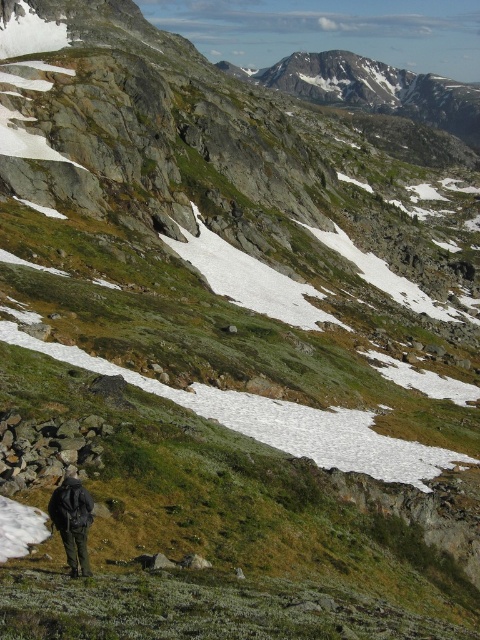
Question: Which point is closer to the camera taking this photo?

Choices:
 (A) (24, 433)
 (B) (71, 561)

Answer: (B)

Question: Is rusty metallic rocks at lower left smaller than dark green jacket at lower left?

Choices:
 (A) no
 (B) yes

Answer: (B)

Question: Which of the following is the farthest from the observer?

Choices:
 (A) (97, 435)
 (B) (60, 500)

Answer: (A)

Question: Is the position of rusty metallic rocks at lower left less distant than that of dark green jacket at lower left?

Choices:
 (A) yes
 (B) no

Answer: (B)

Question: Which object appears closest to the camera in this image?

Choices:
 (A) rusty metallic rocks at lower left
 (B) dark green jacket at lower left

Answer: (B)

Question: Is rusty metallic rocks at lower left further to the viewer compared to dark green jacket at lower left?

Choices:
 (A) no
 (B) yes

Answer: (B)